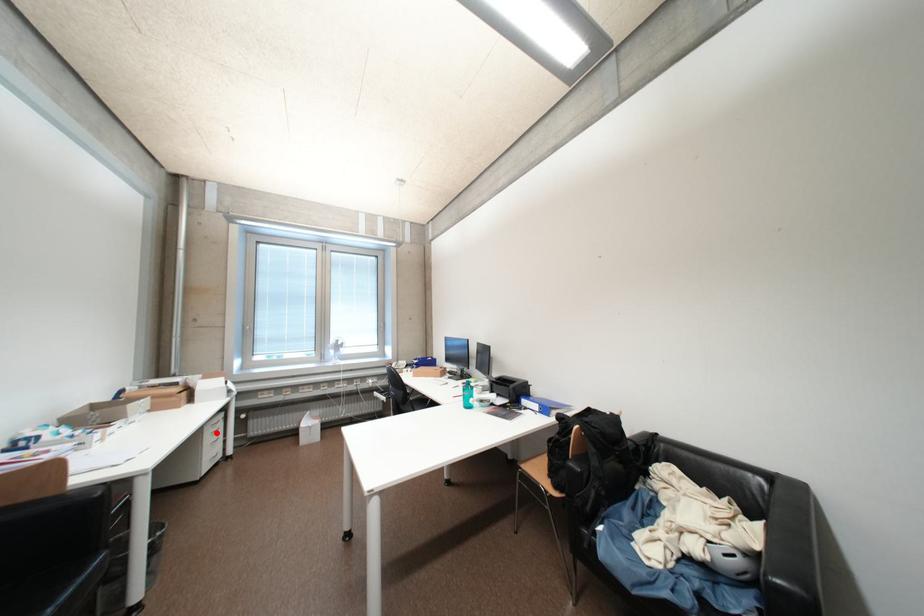
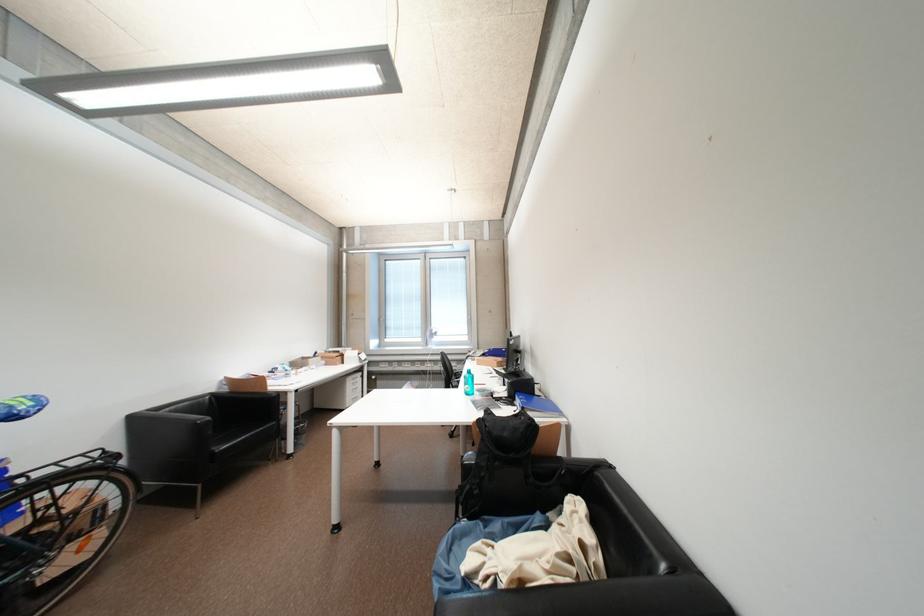
The point at the highlighted location is marked in the first image. Where is the corresponding point in the second image?

(358, 384)